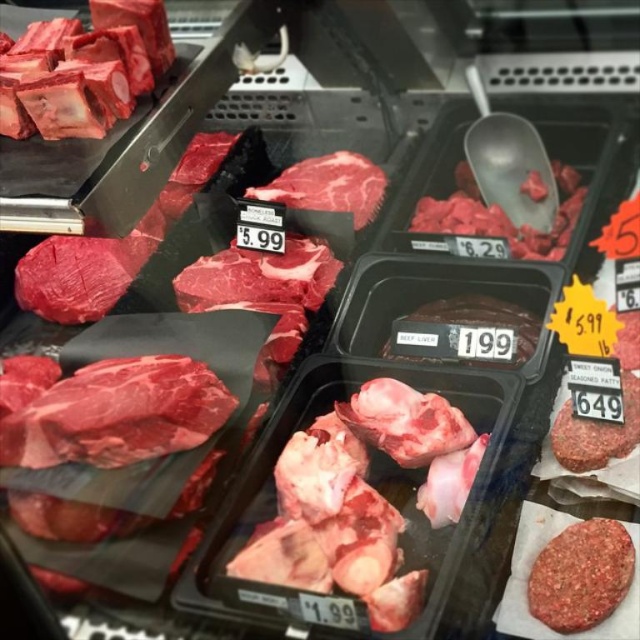
Question: In this image, where is dark red bone-in meat at upper left located relative to dark red raw meat at center?

Choices:
 (A) right
 (B) left

Answer: (B)

Question: Which of the following is the closest to the observer?

Choices:
 (A) (61, 26)
 (B) (360, 227)
 (C) (593, 544)

Answer: (C)

Question: Is pinkish-red ground meat patty at lower right bigger than dark red raw meat at center?

Choices:
 (A) no
 (B) yes

Answer: (A)

Question: Observing the image, what is the correct spatial positioning of pinkish-red ground meat patty at lower right in reference to dark brown textured beef at center?

Choices:
 (A) right
 (B) left

Answer: (A)

Question: Which object is positioned farthest from the dark brown textured beef at center?

Choices:
 (A) dark red bone-in meat at upper left
 (B) pinkish-red ground meat patty at lower right

Answer: (A)

Question: Which of these objects is positioned farthest from the pinkish-red ground meat patty at lower right?

Choices:
 (A) matte red meat at center
 (B) dark brown textured beef at center

Answer: (A)